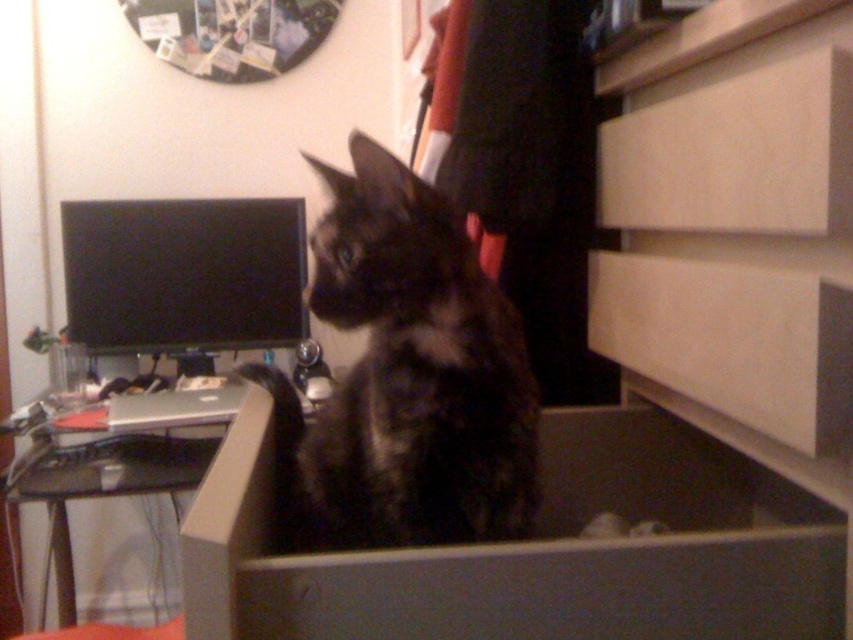
Is gray cardboard box at center thinner than black plastic computer desk at lower left?

In fact, gray cardboard box at center might be wider than black plastic computer desk at lower left.

Is gray cardboard box at center above black plastic computer desk at lower left?

Correct, gray cardboard box at center is located above black plastic computer desk at lower left.

This screenshot has height=640, width=853. I want to click on gray cardboard box at center, so click(x=537, y=550).

Who is more distant from viewer, (642, 468) or (462, 424)?

Point (642, 468)

Is gray cardboard box at center in front of fluffy black cat at center?

Yes.

Which is behind, point (363, 564) or point (485, 346)?

Point (485, 346)

Locate an element on the screen. Image resolution: width=853 pixels, height=640 pixels. gray cardboard box at center is located at coordinates (537, 550).

You are a GUI agent. You are given a task and a screenshot of the screen. Output one action in this format:
    pyautogui.click(x=<x>, y=<y>)
    Task: Click on the fluffy black cat at center
    This screenshot has width=853, height=640.
    Given the screenshot: What is the action you would take?
    pyautogui.click(x=405, y=378)

Does fluffy black cat at center have a lesser height compared to black plastic computer desk at lower left?

Incorrect, fluffy black cat at center's height does not fall short of black plastic computer desk at lower left's.

Does point (532, 454) come behind point (223, 400)?

No, it is in front of (223, 400).

Where is `fluffy black cat at center`? fluffy black cat at center is located at coordinates (405, 378).